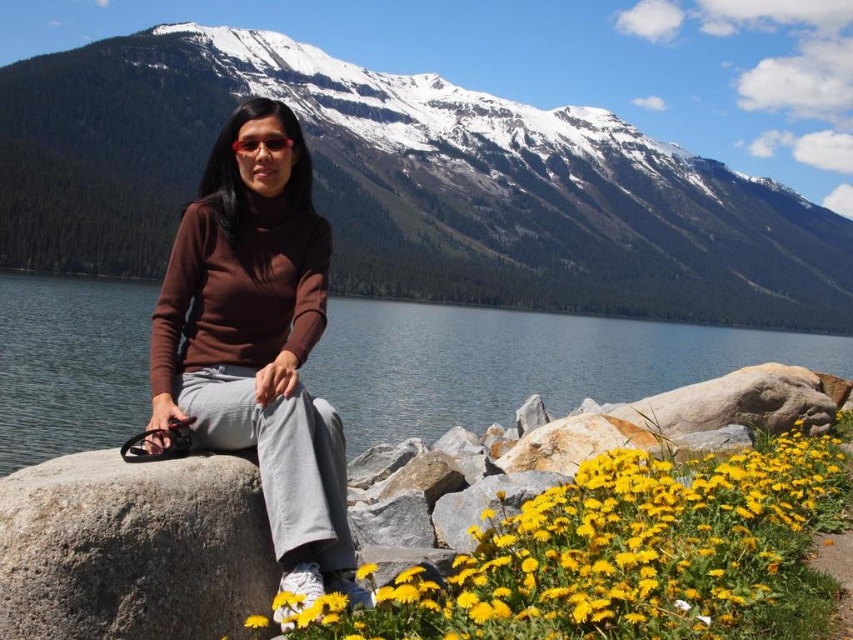
Question: Which of these objects is positioned closest to the brown matte sweater at center?

Choices:
 (A) gray rough boulder at lower left
 (B) yellow matte flower at lower right
 (C) snowy mountain at upper center

Answer: (A)

Question: Which point appears closest to the camera in this image?

Choices:
 (A) (601, 337)
 (B) (695, 556)
 (C) (97, 52)

Answer: (B)

Question: Does yellow matte flower at lower right have a larger size compared to brown matte sweater at center?

Choices:
 (A) no
 (B) yes

Answer: (B)

Question: Is brown matte sweater at center thinner than gray rough boulder at lower left?

Choices:
 (A) yes
 (B) no

Answer: (B)

Question: In this image, where is matte brown sweater at center located relative to brown matte sweater at center?

Choices:
 (A) right
 (B) left

Answer: (A)

Question: Which object is the closest to the matte brown sweater at center?

Choices:
 (A) brown matte sweater at center
 (B) yellow matte flower at lower right

Answer: (B)